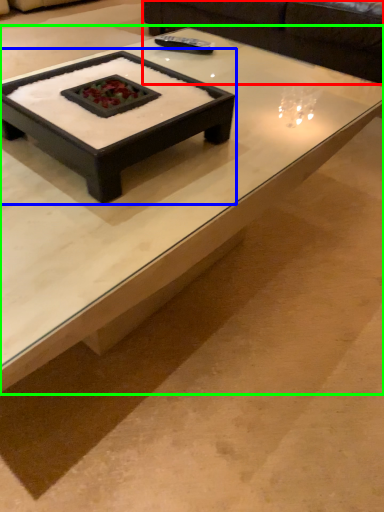
Question: Which object is positioned farthest from couch (highlighted by a red box)? Select from coffee table (highlighted by a blue box) and coffee table (highlighted by a green box).

Choices:
 (A) coffee table
 (B) coffee table

Answer: (A)